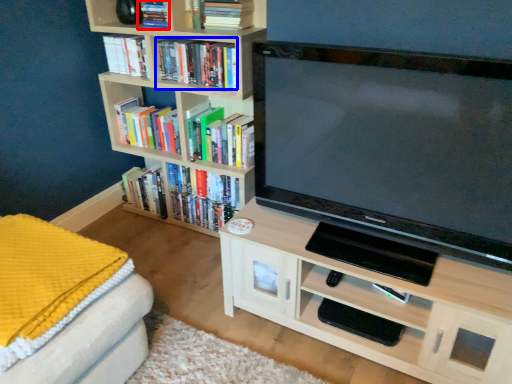
Question: Which object appears farthest to the camera in this image, book (highlighted by a red box) or book (highlighted by a blue box)?

Choices:
 (A) book
 (B) book

Answer: (A)